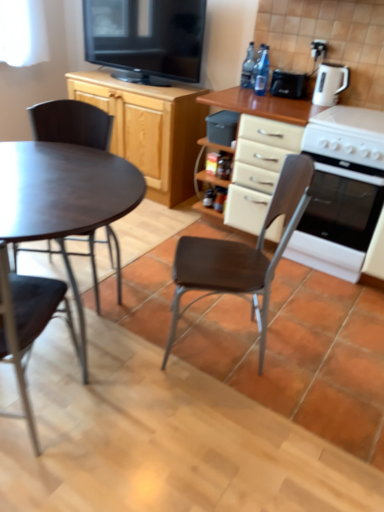
You are a GUI agent. You are given a task and a screenshot of the screen. Output one action in this format:
    pyautogui.click(x=<x>, y=<y>)
    Task: Click on the blank space situated above matte dark brown table at left (from a real-world perspective)
    
    Given the screenshot: What is the action you would take?
    pyautogui.click(x=62, y=175)